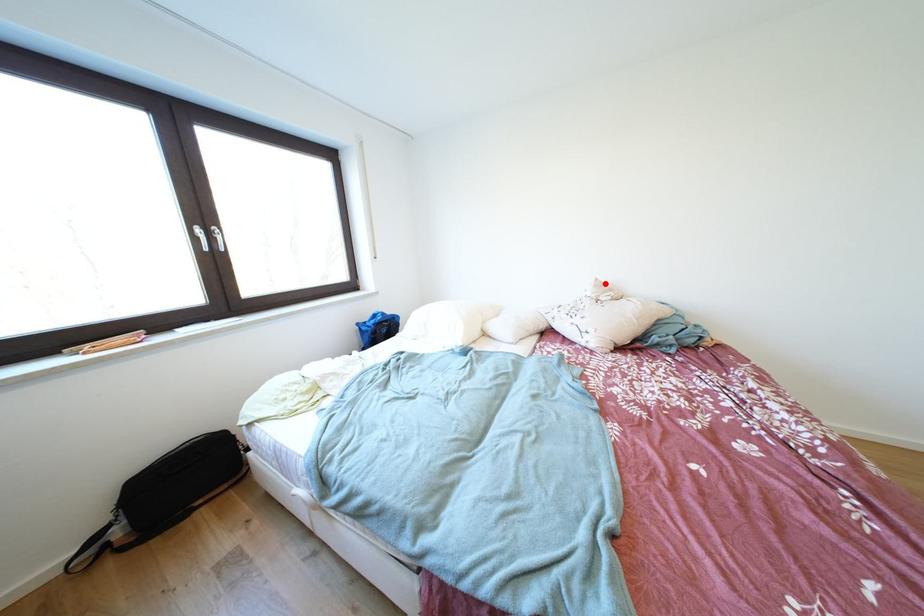
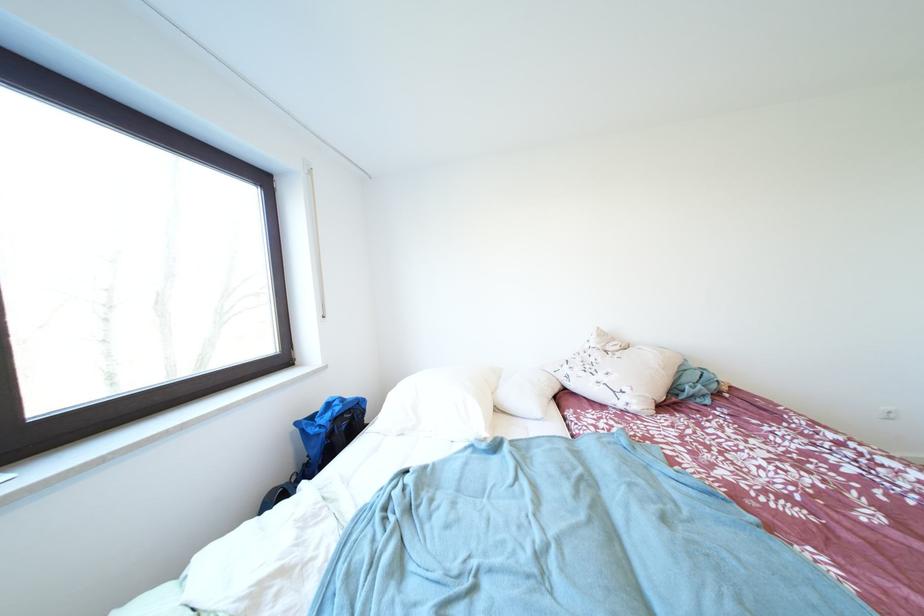
In the second image, find the point that corresponds to the highlighted location in the first image.

(606, 333)